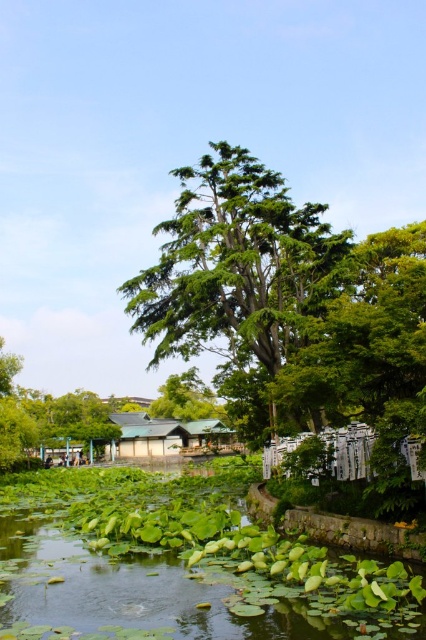
Question: Among these objects, which one is nearest to the camera?

Choices:
 (A) green matte hut at center
 (B) green needle-like leaves at center
 (C) green leafy tree at right
 (D) green leafy water at lower left

Answer: (D)

Question: Which point is farther to the camera?

Choices:
 (A) (238, 561)
 (B) (267, 241)

Answer: (B)

Question: Is green needle-like leaves at center to the left of green leafy tree at right from the viewer's perspective?

Choices:
 (A) yes
 (B) no

Answer: (A)

Question: Is green leafy water at lower left below green needle-like leaves at center?

Choices:
 (A) no
 (B) yes

Answer: (B)

Question: Can you confirm if green leafy water at lower left is positioned below green matte hut at center?

Choices:
 (A) no
 (B) yes

Answer: (A)

Question: Which is farther from the green matte hut at center?

Choices:
 (A) green needle-like leaves at center
 (B) green leafy tree at right
 (C) green leafy water at lower left

Answer: (B)